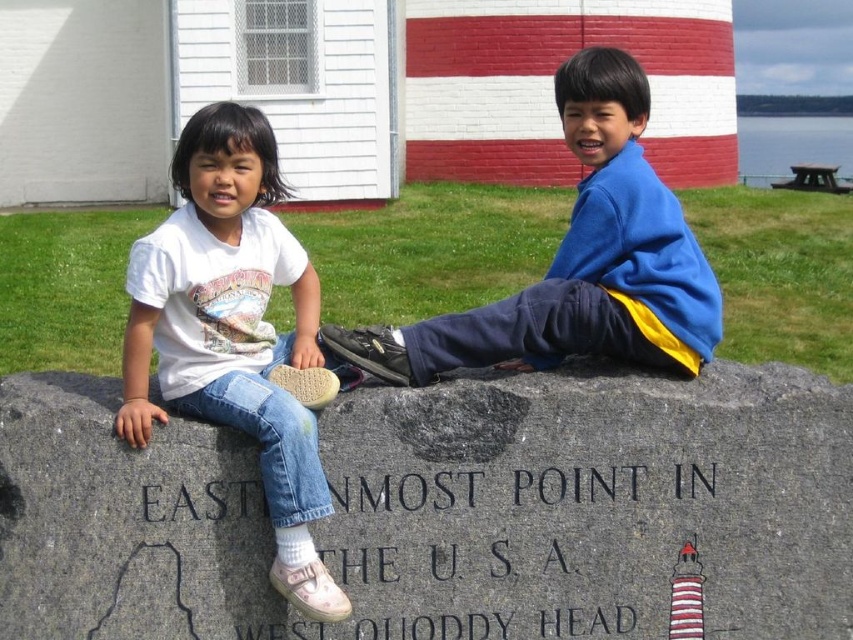
Where is `white cotton shirt at left`? white cotton shirt at left is located at coordinates (233, 330).

The width and height of the screenshot is (853, 640). Identify the location of white cotton shirt at left. coord(233,330).

This screenshot has width=853, height=640. What are the coordinates of `white cotton shirt at left` in the screenshot? It's located at (233, 330).

Is white cotton shirt at left taller than blue fleece jacket at center?

Incorrect, white cotton shirt at left's height is not larger of blue fleece jacket at center's.

Is white cotton shirt at left below blue fleece jacket at center?

Indeed, white cotton shirt at left is positioned under blue fleece jacket at center.

Between point (125, 401) and point (412, 385), which one is positioned behind?

Point (412, 385)

Locate an element on the screen. white cotton shirt at left is located at coordinates (233, 330).

Does point (654, 180) come in front of point (605, 486)?

No, (654, 180) is behind (605, 486).

Is blue fleece jacket at center shorter than black granite stone at lower center?

In fact, blue fleece jacket at center may be taller than black granite stone at lower center.

Is point (554, 305) positioned after point (363, 509)?

Yes, it is behind point (363, 509).

Locate an element on the screen. blue fleece jacket at center is located at coordinates (579, 260).